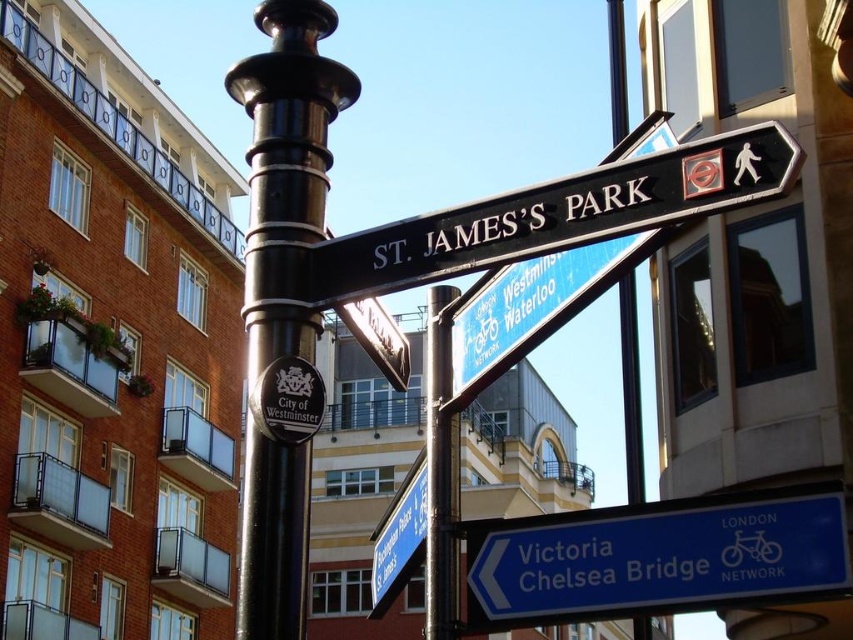
Question: Considering the real-world distances, which object is closest to the blue plastic sign at lower right?

Choices:
 (A) blue plastic street sign at lower center
 (B) black polished wood sign at upper center

Answer: (B)

Question: Considering the relative positions of black polished wood sign at upper center and blue plastic street sign at lower center in the image provided, where is black polished wood sign at upper center located with respect to blue plastic street sign at lower center?

Choices:
 (A) above
 (B) below

Answer: (A)

Question: Can you confirm if black polished metal pole at center is positioned to the left of black metal pole at center?

Choices:
 (A) yes
 (B) no

Answer: (A)

Question: Considering the real-world distances, which object is farthest from the blue plastic street sign at lower center?

Choices:
 (A) blue plastic sign at lower right
 (B) black polished wood sign at upper center
 (C) black polished metal pole at center

Answer: (B)

Question: Is black polished wood sign at upper center thinner than black metal pole at center?

Choices:
 (A) no
 (B) yes

Answer: (A)

Question: Which of the following is the farthest from the observer?

Choices:
 (A) black polished metal pole at center
 (B) black metal pole at center

Answer: (B)